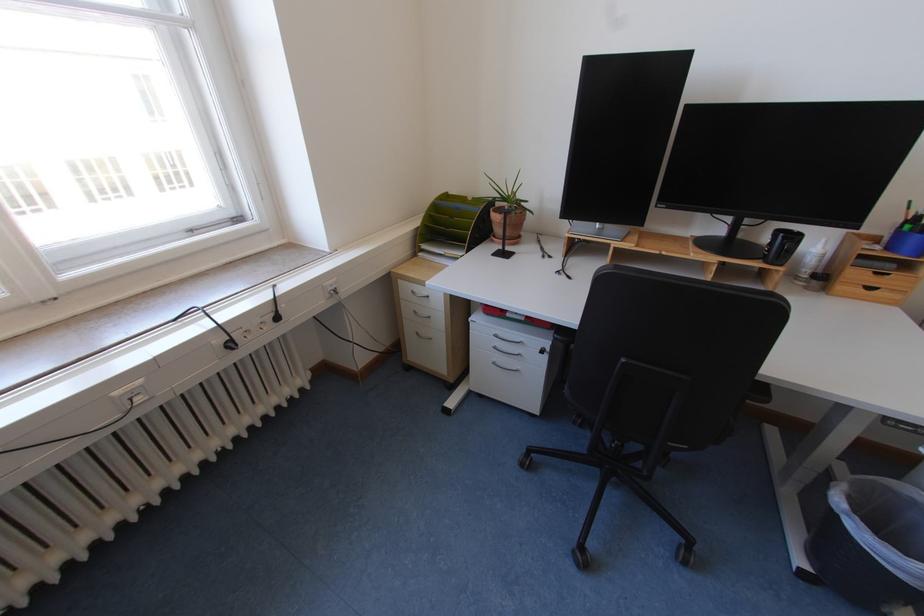
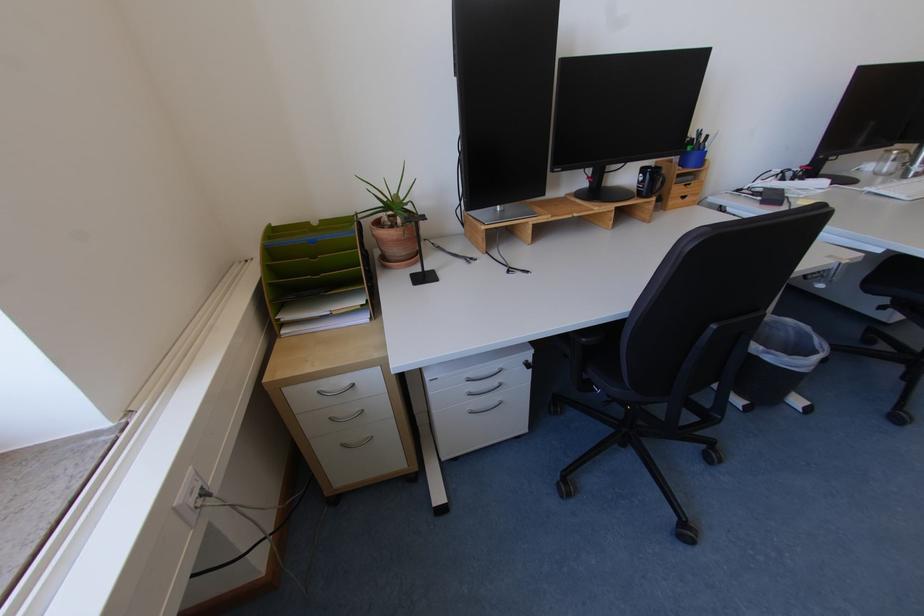
Where in the second image is the point corresponding to [819,572] from the first image?

(755, 403)